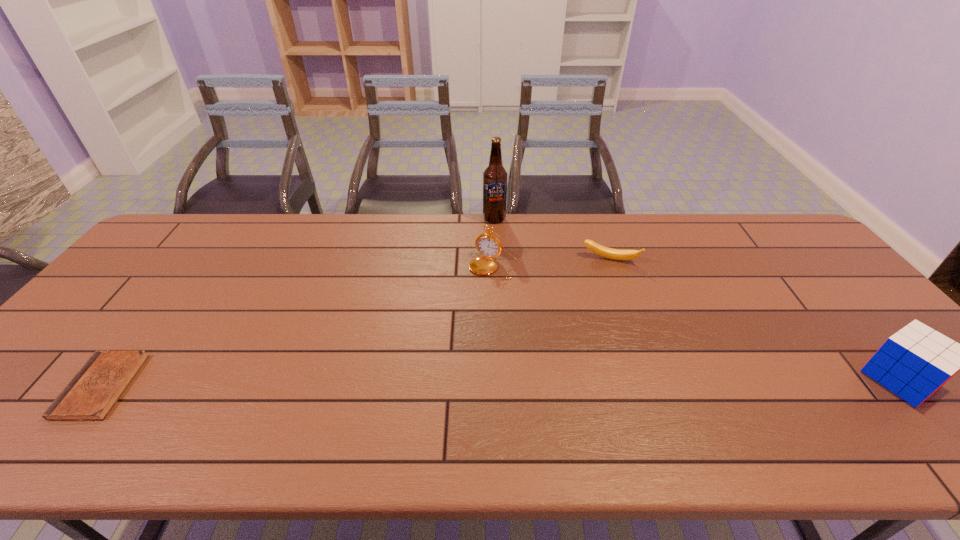
Locate an element on the screen. The height and width of the screenshot is (540, 960). banana situated at the far edge is located at coordinates (615, 254).

Where is `object at the near edge`? object at the near edge is located at coordinates (91, 394).

Locate an element on the screen. object present at the left edge is located at coordinates (91, 394).

Find the location of a particular element. Image resolution: width=960 pixels, height=540 pixels. object located at the near left corner is located at coordinates (91, 394).

The width and height of the screenshot is (960, 540). In the image, there is a desktop. Find the location of `free space at the far edge`. free space at the far edge is located at coordinates coord(236,249).

You are a GUI agent. You are given a task and a screenshot of the screen. Output one action in this format:
    pyautogui.click(x=<x>, y=<y>)
    Task: Click on the free space at the near edge of the desktop
    Image resolution: width=960 pixels, height=540 pixels.
    Given the screenshot: What is the action you would take?
    pyautogui.click(x=234, y=411)

At what (x,y) coordinates should I click in order to perform the action: click on free space at the left edge of the desktop. Please return your answer as a coordinate pair (x, y). Looking at the image, I should click on (123, 334).

Locate an element on the screen. This screenshot has height=540, width=960. vacant space at the right edge of the desktop is located at coordinates (774, 257).

At what (x,y) coordinates should I click in order to perform the action: click on vacant area at the near right corner. Please return your answer as a coordinate pair (x, y). The width and height of the screenshot is (960, 540). Looking at the image, I should click on (938, 399).

Identify the location of empty space that is in between the second shortest object and the shortest object. The height and width of the screenshot is (540, 960). (356, 323).